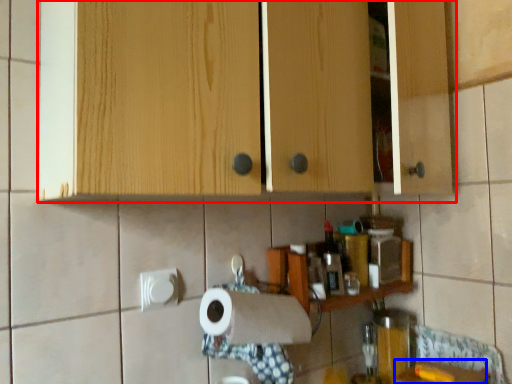
Question: Which object is further to the camera taking this photo, cabinetry (highlighted by a red box) or counter top (highlighted by a blue box)?

Choices:
 (A) cabinetry
 (B) counter top

Answer: (B)